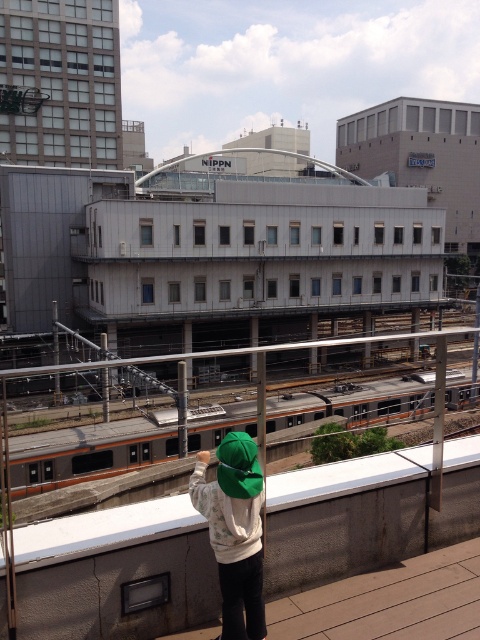
Does orange metallic train at center have a greater width compared to green fabric cap at center?

Yes, orange metallic train at center is wider than green fabric cap at center.

Is point (266, 401) farther from viewer compared to point (238, 612)?

Yes, point (266, 401) is farther from viewer.

Where is `orange metallic train at center`? This screenshot has height=640, width=480. orange metallic train at center is located at coordinates (104, 467).